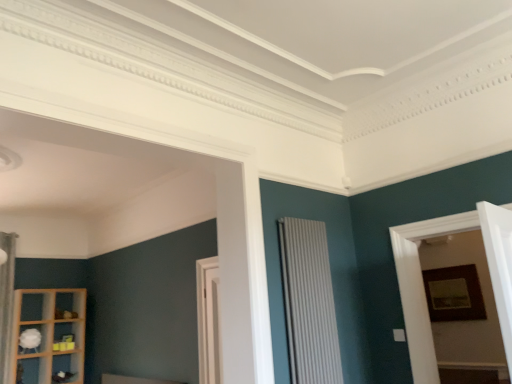
Question: Are white textured radiator at center and white matte shelf at lower left, acting as the second shelf starting from the bottom, located far from each other?

Choices:
 (A) no
 (B) yes

Answer: (B)

Question: Is white textured radiator at center bigger than white matte shelf at lower left, acting as the second shelf starting from the bottom?

Choices:
 (A) no
 (B) yes

Answer: (B)

Question: Considering the relative positions of white textured radiator at center and white matte shelf at lower left, which appears as the first shelf when viewed from the top, in the image provided, is white textured radiator at center in front of white matte shelf at lower left, which appears as the first shelf when viewed from the top,?

Choices:
 (A) no
 (B) yes

Answer: (B)

Question: Is white matte shelf at lower left, acting as the second shelf starting from the bottom, at the back of white textured radiator at center?

Choices:
 (A) no
 (B) yes

Answer: (B)

Question: Is white textured radiator at center oriented towards white matte shelf at lower left, acting as the second shelf starting from the bottom?

Choices:
 (A) no
 (B) yes

Answer: (A)

Question: From a real-world perspective, is white textured radiator at center below white matte shelf at lower left, which appears as the first shelf when viewed from the top?

Choices:
 (A) no
 (B) yes

Answer: (A)

Question: From a real-world perspective, is white textured radiator at center beneath wooden picture frame at right?

Choices:
 (A) yes
 (B) no

Answer: (B)

Question: Could wooden picture frame at right be considered to be inside white textured radiator at center?

Choices:
 (A) yes
 (B) no

Answer: (B)

Question: Could you tell me if white textured radiator at center is facing wooden picture frame at right?

Choices:
 (A) yes
 (B) no

Answer: (B)

Question: Are white textured radiator at center and wooden picture frame at right beside each other?

Choices:
 (A) yes
 (B) no

Answer: (B)

Question: From the image's perspective, would you say white textured radiator at center is positioned over wooden picture frame at right?

Choices:
 (A) no
 (B) yes

Answer: (B)

Question: Is white textured radiator at center smaller than wooden picture frame at right?

Choices:
 (A) yes
 (B) no

Answer: (B)

Question: Is white fabric curtain at left not within wooden shelf at lower left, the first shelf when ordered from bottom to top?

Choices:
 (A) no
 (B) yes

Answer: (B)